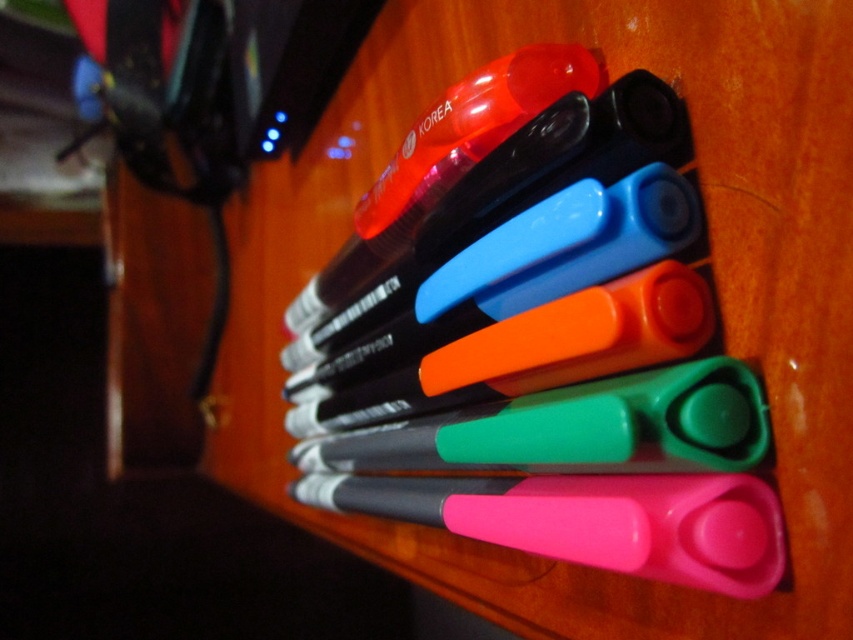
Is point (683, 365) positioned in front of point (740, 387)?

Yes, it is in front of point (740, 387).

Is the position of translucent plastic highlighter at upper center more distant than that of green plastic scissors at center?

No, it is in front of green plastic scissors at center.

Locate an element on the screen. This screenshot has width=853, height=640. translucent plastic highlighter at upper center is located at coordinates (537, 339).

Does pink plastic scissors at center have a smaller size compared to green plastic scissors at center?

Yes, pink plastic scissors at center is smaller than green plastic scissors at center.

Can you confirm if pink plastic scissors at center is positioned above green plastic scissors at center?

No, pink plastic scissors at center is not above green plastic scissors at center.

The height and width of the screenshot is (640, 853). What do you see at coordinates (590, 520) in the screenshot?
I see `pink plastic scissors at center` at bounding box center [590, 520].

The image size is (853, 640). I want to click on pink plastic scissors at center, so click(x=590, y=520).

Which is more to the right, translucent plastic highlighter at upper center or pink plastic scissors at center?

pink plastic scissors at center is more to the right.

Between translucent plastic highlighter at upper center and pink plastic scissors at center, which one has more height?

Standing taller between the two is translucent plastic highlighter at upper center.

Between point (758, 385) and point (689, 541), which one is positioned in front?

Positioned in front is point (689, 541).

Identify the location of translucent plastic highlighter at upper center. The image size is (853, 640). (537, 339).